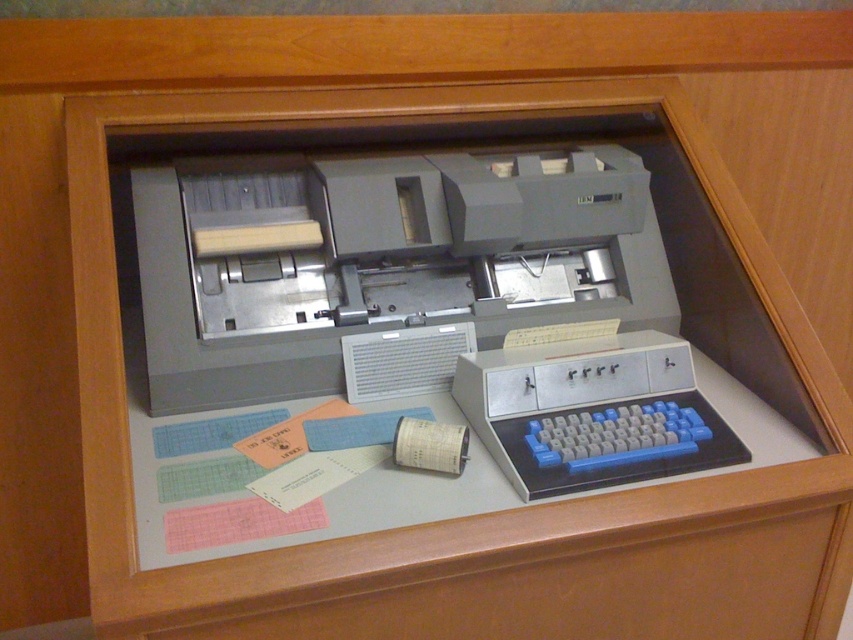
Question: Which point appears closest to the camera in this image?

Choices:
 (A) (532, 273)
 (B) (694, 403)

Answer: (B)

Question: Which point appears closest to the camera in this image?

Choices:
 (A) (635, 394)
 (B) (579, 157)

Answer: (A)

Question: Is matte gray printer at center bigger than blue plastic keyboard at center?

Choices:
 (A) no
 (B) yes

Answer: (B)

Question: Which point is farther from the camera taking this photo?

Choices:
 (A) (521, 429)
 (B) (370, 186)

Answer: (B)

Question: Does matte gray printer at center have a lesser width compared to blue plastic keyboard at center?

Choices:
 (A) no
 (B) yes

Answer: (A)

Question: Does matte gray printer at center have a greater width compared to blue plastic keyboard at center?

Choices:
 (A) yes
 (B) no

Answer: (A)